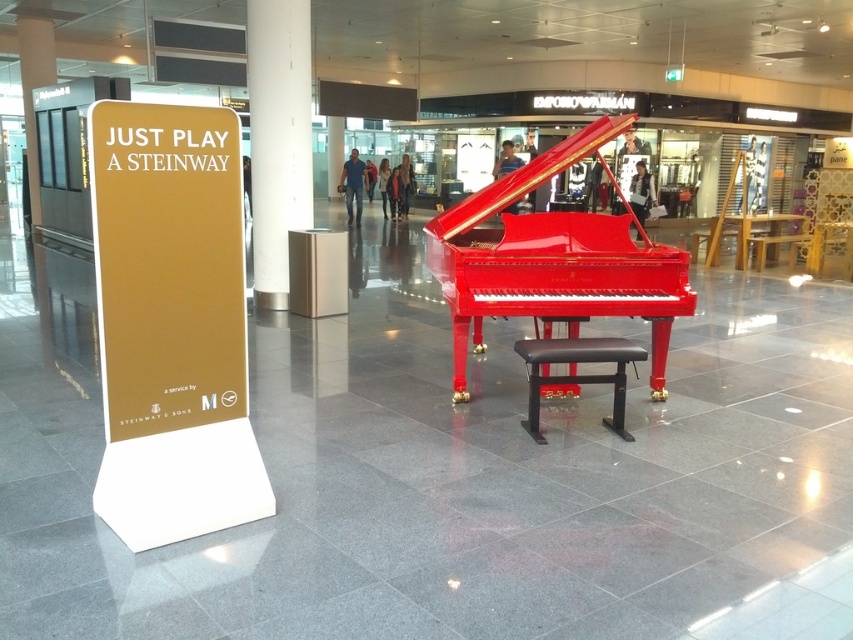
Question: Is glossy red piano at center further to camera compared to black leather stool at center?

Choices:
 (A) yes
 (B) no

Answer: (A)

Question: Can you confirm if glossy red piano at center is positioned to the right of white glossy pillar at center?

Choices:
 (A) no
 (B) yes

Answer: (B)

Question: Among these points, which one is farthest from the camera?

Choices:
 (A) (537, 227)
 (B) (334, 132)
 (C) (616, 408)
 (D) (289, 163)

Answer: (B)

Question: Is black leather stool at center further to the viewer compared to metallic gold pillar at upper left?

Choices:
 (A) yes
 (B) no

Answer: (B)

Question: Which of the following is the closest to the observer?

Choices:
 (A) metallic gray pillar at center
 (B) white glossy pillar at center

Answer: (B)

Question: Which point appears farthest from the camera in this image?

Choices:
 (A) (612, 340)
 (B) (338, 168)
 (C) (27, 170)

Answer: (B)